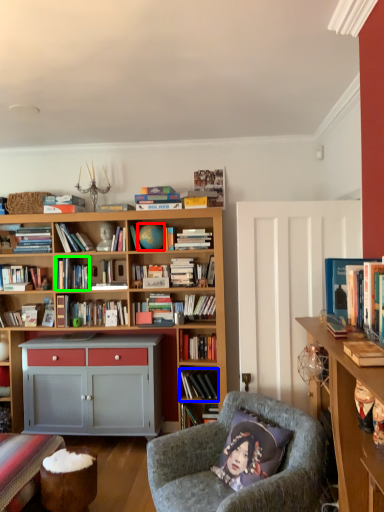
Question: Estimate the real-world distances between objects in this image. Which object is farther from teal (highlighted by a red box), book (highlighted by a blue box) or book (highlighted by a green box)?

Choices:
 (A) book
 (B) book

Answer: (A)